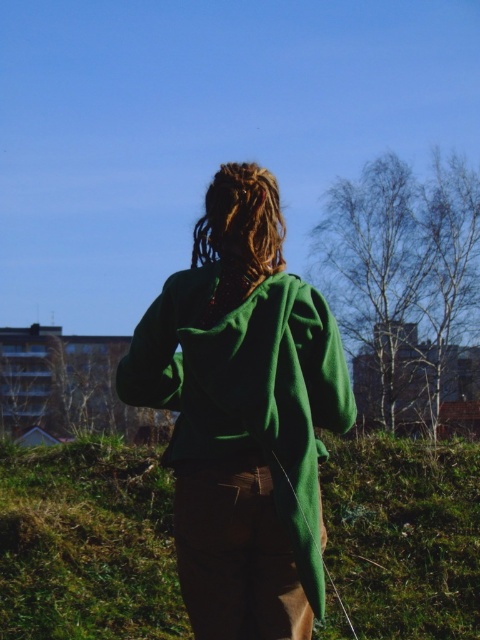
Does green fleece jacket at center lie in front of green fabric at center?

Yes, it is.

Consider the image. Which is below, green fleece jacket at center or green fabric at center?

green fabric at center

Which is behind, point (197, 529) or point (431, 452)?

The point (431, 452) is behind.

The width and height of the screenshot is (480, 640). In order to click on green fleece jacket at center in this screenshot , I will do `click(242, 413)`.